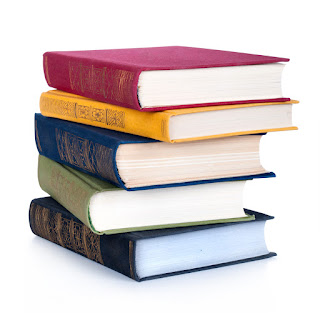
Identify the location of stacked hardcover books. (104, 84), (102, 112), (98, 146), (86, 189), (96, 247).